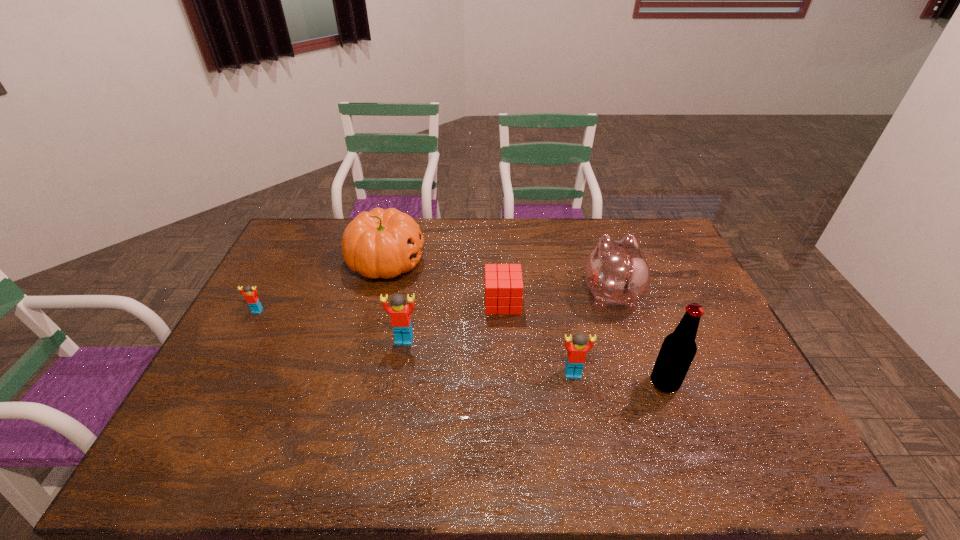
The width and height of the screenshot is (960, 540). What are the coordinates of `object that is at the left edge` in the screenshot? It's located at (251, 297).

Identify the location of free space at the far edge of the desktop. (559, 227).

Find the location of `blank space at the near edge`. blank space at the near edge is located at coordinates (266, 424).

In the image, there is a desktop. Where is `vacant space at the right edge`? The width and height of the screenshot is (960, 540). vacant space at the right edge is located at coordinates (726, 383).

I want to click on free space between the beer bottle and the pumpkin, so click(525, 322).

This screenshot has width=960, height=540. In order to click on free point between the fifth object from left to right and the second Lego from right to left in this screenshot , I will do `click(489, 357)`.

You are a GUI agent. You are given a task and a screenshot of the screen. Output one action in this format:
    pyautogui.click(x=<x>, y=<y>)
    Task: Click on the blank region between the piggy bank and the farthest Lego
    This screenshot has width=960, height=540.
    Given the screenshot: What is the action you would take?
    pyautogui.click(x=434, y=302)

Locate an element on the screen. This screenshot has width=960, height=540. empty location between the cube and the leftmost object is located at coordinates (380, 307).

In order to click on blank region between the second shortest Lego and the piggy bank in this screenshot , I will do `click(591, 334)`.

Locate an element on the screen. This screenshot has width=960, height=540. free space between the cube and the pumpkin is located at coordinates (444, 282).